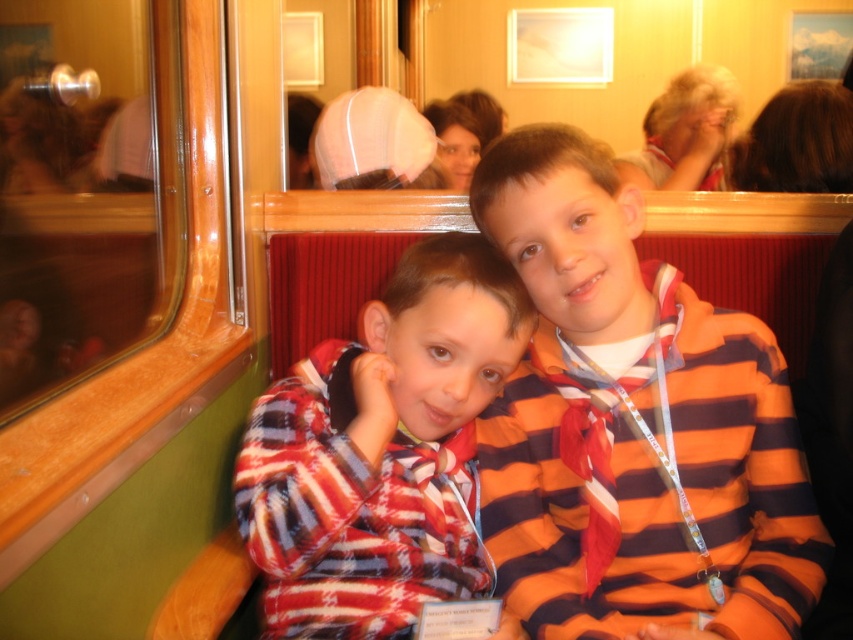
Is point (621, 186) in front of point (416, 348)?

That is False.

Where is `striped fabric shirt at center`? Image resolution: width=853 pixels, height=640 pixels. striped fabric shirt at center is located at coordinates (633, 426).